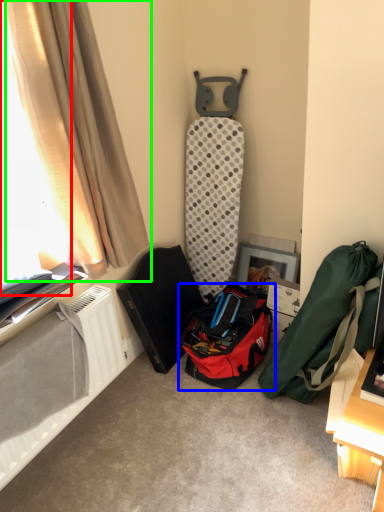
Question: Considering the real-world distances, which object is farthest from window screen (highlighted by a red box)? luggage and bags (highlighted by a blue box) or curtain (highlighted by a green box)?

Choices:
 (A) luggage and bags
 (B) curtain

Answer: (A)